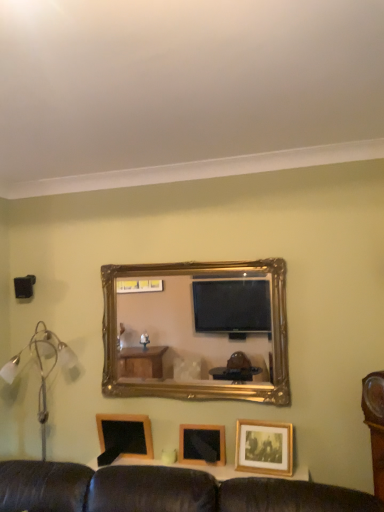
Question: From the image's perspective, is silver metallic floor lamp at left above or below wooden picture frame at center, which appears as the 2th picture frame when viewed from the right?

Choices:
 (A) above
 (B) below

Answer: (A)

Question: Does point (41, 415) appear closer or farther from the camera than point (183, 424)?

Choices:
 (A) farther
 (B) closer

Answer: (A)

Question: Based on their relative distances, which object is farther from the wooden picture frame at center, which appears as the 2th picture frame when viewed from the right?

Choices:
 (A) silver metallic floor lamp at left
 (B) wooden blackboard at lower left, which is counted as the 1th picture frame, starting from the left
 (C) black plastic speaker at left
 (D) wooden picture frame at lower right, positioned as the 3th picture frame in left-to-right order
 (E) gold/gilded mirror at center

Answer: (C)

Question: Estimate the real-world distances between objects in this image. Which object is closer to the wooden blackboard at lower left, which is counted as the 1th picture frame, starting from the left?

Choices:
 (A) wooden picture frame at center, arranged as the second picture frame when viewed from the left
 (B) wooden picture frame at lower right, positioned as the 3th picture frame in left-to-right order
 (C) gold/gilded mirror at center
 (D) black plastic speaker at left
 (E) silver metallic floor lamp at left

Answer: (A)